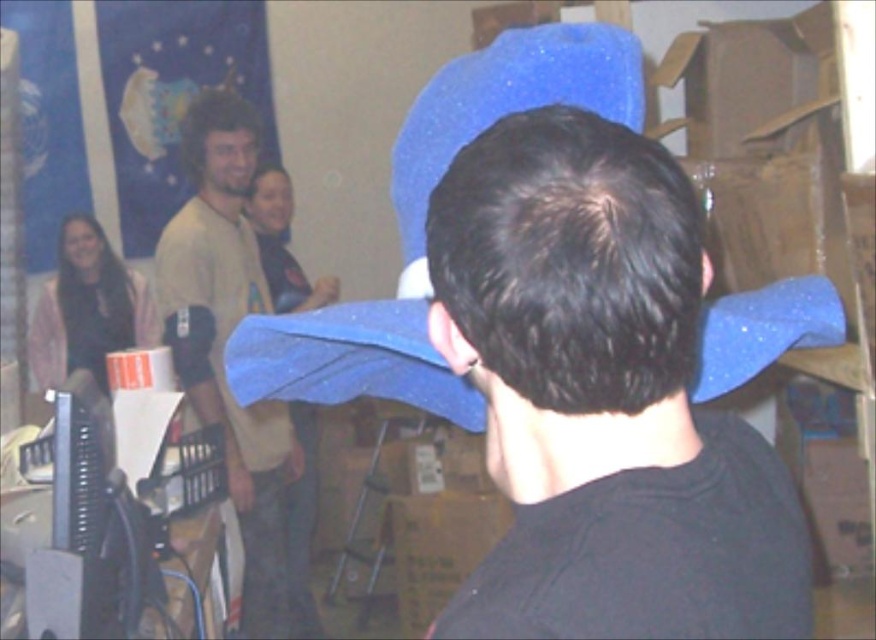
Does matte yellow shirt at upper left have a larger size compared to matte pink sweater at left?

Indeed, matte yellow shirt at upper left has a larger size compared to matte pink sweater at left.

Is matte yellow shirt at upper left thinner than matte pink sweater at left?

Correct, matte yellow shirt at upper left's width is less than matte pink sweater at left's.

Image resolution: width=876 pixels, height=640 pixels. I want to click on matte yellow shirt at upper left, so click(221, 360).

Locate an element on the screen. The height and width of the screenshot is (640, 876). matte yellow shirt at upper left is located at coordinates (221, 360).

From the picture: Between matte blue hat at center and matte pink sweater at left, which one is positioned higher?

matte pink sweater at left

Is matte blue hat at center to the right of matte pink sweater at left from the viewer's perspective?

Yes, matte blue hat at center is to the right of matte pink sweater at left.

What do you see at coordinates (601, 396) in the screenshot? I see `matte blue hat at center` at bounding box center [601, 396].

Where is `matte blue hat at center`? The width and height of the screenshot is (876, 640). matte blue hat at center is located at coordinates (601, 396).

Which is behind, point (648, 435) or point (590, 88)?

Point (590, 88)

Can you confirm if matte blue hat at center is positioned above blue sparkly hat at center?

Incorrect, matte blue hat at center is not positioned above blue sparkly hat at center.

Is point (613, 419) positioned before point (390, 378)?

Yes, it is in front of point (390, 378).

Find the location of `matte blue hat at center`. matte blue hat at center is located at coordinates (601, 396).